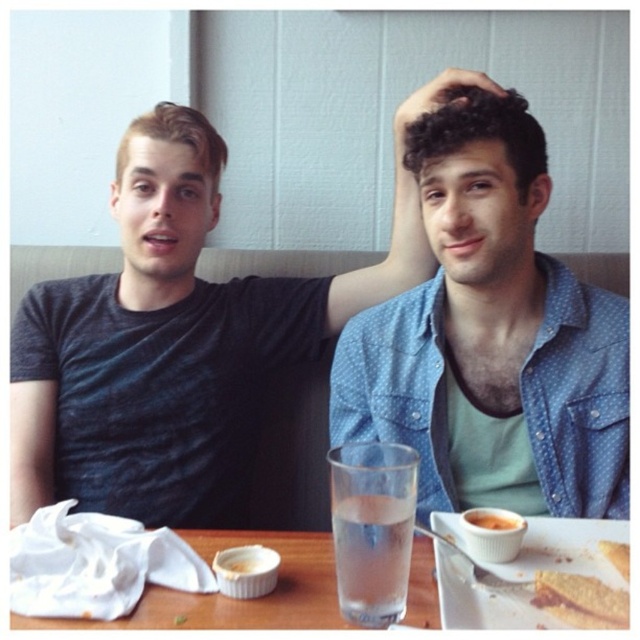
You are taking a photo of the two people at the table. You want to focus on the point closer to the camera between the two points labeled as point [321,618] and point [483,518]. Which point should you focus on?

You should focus on point [321,618] because it is closer to the camera than point [483,518].

You are standing at the point marked by the coordinate point [232,598]. What object is located at that point?

The point [232,598] marks the white cloth at lower left.

You are a photographer standing in front of the table. You want to take a photo of the golden crispy bread at lower right without the blue dotted shirt at upper right appearing in the frame. Is this possible based on their positions?

The blue dotted shirt at upper right is further to the viewer than golden crispy bread at lower right, so it is closer to the camera. This means the blue dotted shirt at upper right would block the view of the golden crispy bread at lower right, making it impossible to capture the golden crispy bread at lower right without the blue dotted shirt at upper right in the frame.